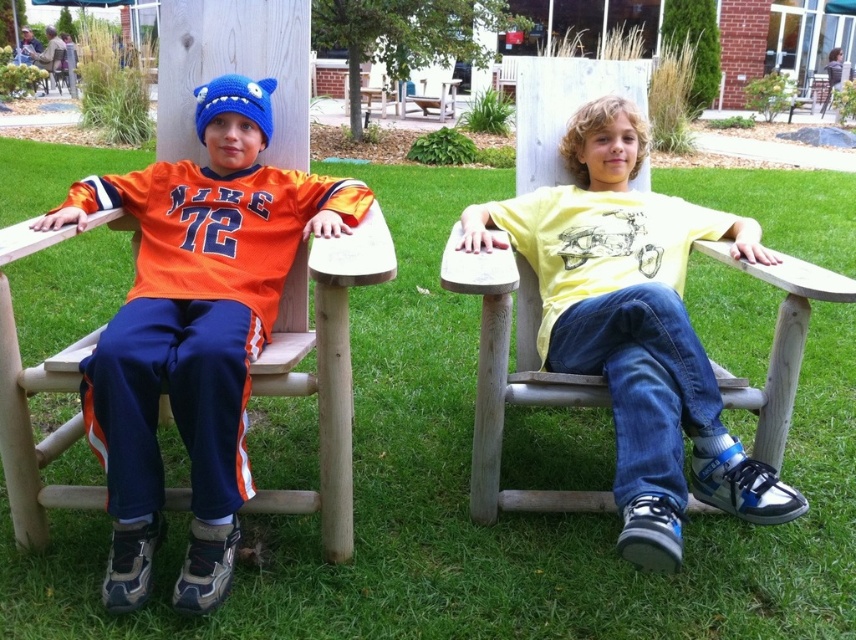
You are standing in a park and see two boys sitting on chairs. You want to approach the boy wearing the yellow matte shirt at center. Which direction should you walk to get closer to him compared to the orange jersey at left?

The yellow matte shirt at center is closer to the viewer than the orange jersey at left, so you should walk towards the yellow matte shirt at center to get closer to him compared to the orange jersey at left.

You are a photographer setting up for a group photo. You need to position the yellow matte shirt at center and the orange jersey at left so that they are exactly 30 inches apart. Based on their current positions, do you need to move them closer or farther apart to achieve the desired distance?

The yellow matte shirt at center is currently 29.81 inches from the orange jersey at left. To reach the desired 30 inches, you need to move them slightly farther apart.